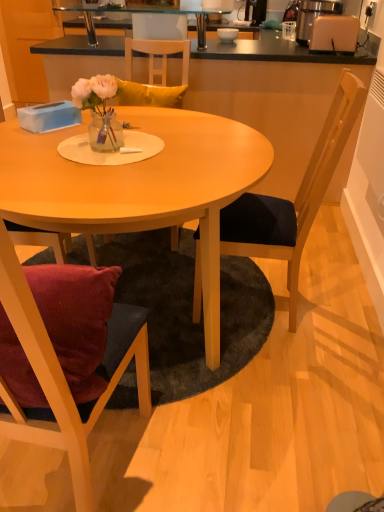
At what (x,y) coordinates should I click in order to perform the action: click on free region under wooden chair at left, marked as the 1th chair in a left-to-right arrangement (from a real-world perspective). Please return your answer as a coordinate pair (x, y). The image size is (384, 512). Looking at the image, I should click on (88, 468).